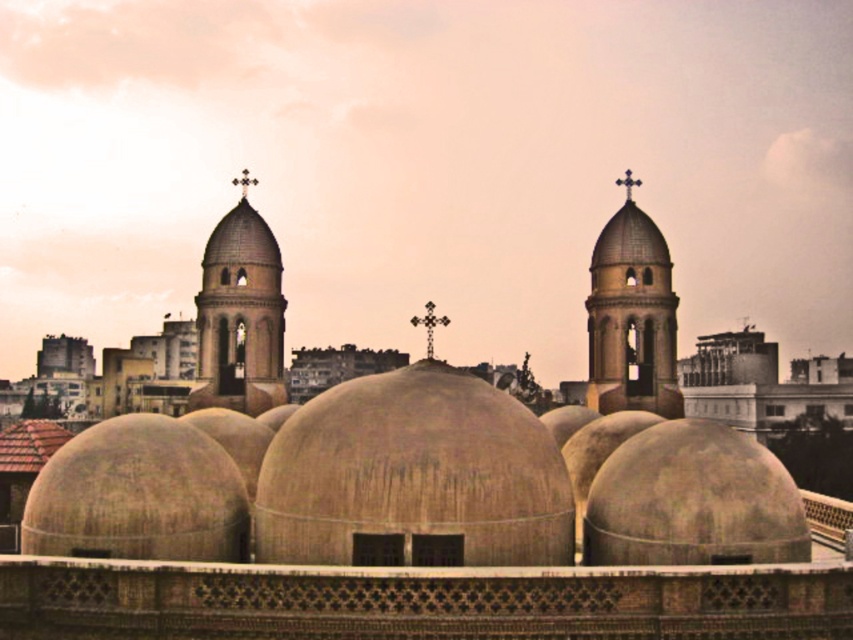
Can you confirm if beige concrete dome at center is positioned above matte concrete dome at center?

Indeed, beige concrete dome at center is positioned over matte concrete dome at center.

Does point (550, 499) come closer to viewer compared to point (634, 456)?

Yes.

Locate an element on the screen. This screenshot has height=640, width=853. beige concrete dome at center is located at coordinates click(x=413, y=477).

Who is positioned more to the right, beige concrete domes at center or beige concrete dome at center?

Positioned to the right is beige concrete domes at center.

Who is shorter, beige concrete domes at center or beige concrete dome at center?

beige concrete dome at center

Is point (86, 483) positioned before point (335, 506)?

No.

Find the location of `beige concrete domes at center`. beige concrete domes at center is located at coordinates (415, 499).

Which of these two, beige concrete domes at center or matte concrete dome at center, stands taller?

beige concrete domes at center

Does point (68, 515) lie in front of point (759, 497)?

Yes, it is.

Which is behind, point (213, 291) or point (631, 506)?

The point (213, 291) is behind.

Where is `beige concrete domes at center`? This screenshot has height=640, width=853. beige concrete domes at center is located at coordinates (415, 499).